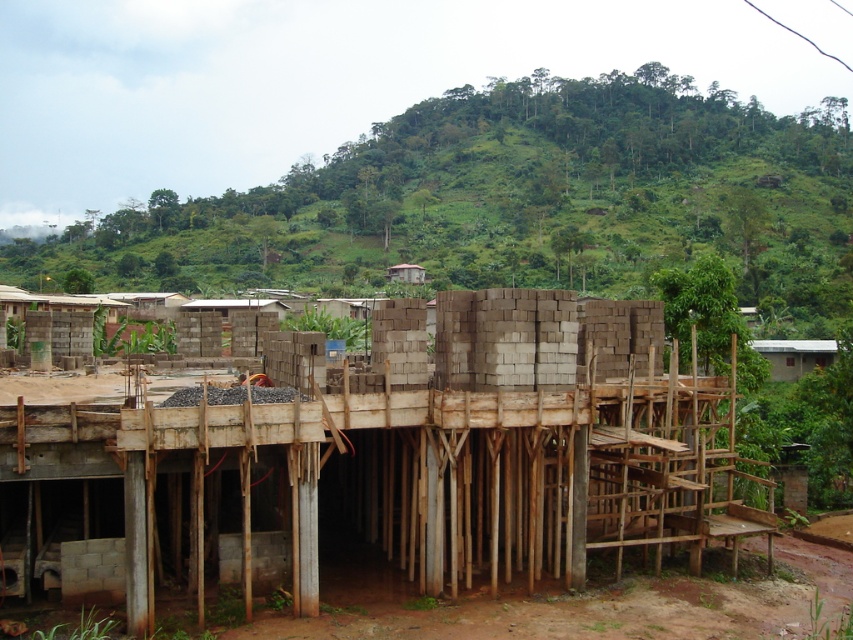
Question: Can you confirm if gray concrete blocks at center is smaller than gray concrete foundation at lower left?

Choices:
 (A) no
 (B) yes

Answer: (A)

Question: Does gray concrete blocks at center appear over gray concrete foundation at lower left?

Choices:
 (A) no
 (B) yes

Answer: (B)

Question: Which of the following is the closest to the observer?

Choices:
 (A) gray concrete foundation at lower left
 (B) gray concrete blocks at center

Answer: (B)

Question: Does gray concrete blocks at center have a smaller size compared to gray concrete foundation at lower left?

Choices:
 (A) no
 (B) yes

Answer: (A)

Question: Which point is closer to the camera?

Choices:
 (A) (109, 548)
 (B) (86, 499)

Answer: (A)